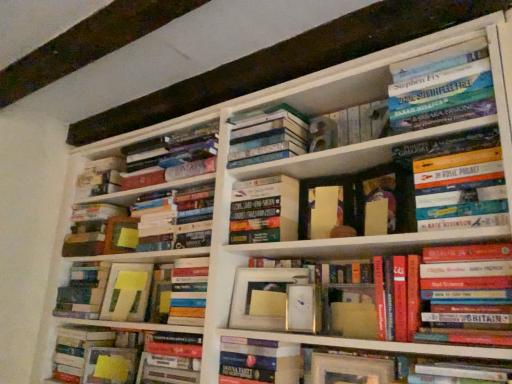
Question: Does hardcover book at center, the 5th book when ordered from left to right, have a larger size compared to hardcover book at upper right, acting as the eleventh book starting from the left?

Choices:
 (A) yes
 (B) no

Answer: (A)

Question: From a real-world perspective, is hardcover book at center, the 5th book when ordered from left to right, under hardcover book at upper right, acting as the eleventh book starting from the left?

Choices:
 (A) yes
 (B) no

Answer: (A)

Question: Is hardcover book at center, the eighth book from the right, looking in the opposite direction of hardcover book at upper right, the second book in the right-to-left sequence?

Choices:
 (A) no
 (B) yes

Answer: (A)

Question: Is hardcover book at center, the 5th book when ordered from left to right, positioned in front of hardcover book at upper right, the second book in the right-to-left sequence?

Choices:
 (A) yes
 (B) no

Answer: (B)

Question: Is hardcover book at center, the 5th book when ordered from left to right, smaller than hardcover book at upper right, the second book in the right-to-left sequence?

Choices:
 (A) no
 (B) yes

Answer: (A)

Question: Is hardcover book at center, the 5th book when ordered from left to right, aimed at hardcover book at upper right, acting as the eleventh book starting from the left?

Choices:
 (A) no
 (B) yes

Answer: (A)

Question: Is hardcover book at upper right, the second book in the right-to-left sequence, at the back of matte white frame at center, the third paperback book positioned from the back?

Choices:
 (A) no
 (B) yes

Answer: (A)

Question: From the image's perspective, is matte white frame at center, the third paperback book positioned from the back, above hardcover book at upper right, acting as the eleventh book starting from the left?

Choices:
 (A) no
 (B) yes

Answer: (A)

Question: Does matte white frame at center, which appears as the 3th paperback book when viewed from the left, touch hardcover book at upper right, acting as the eleventh book starting from the left?

Choices:
 (A) yes
 (B) no

Answer: (B)

Question: From a real-world perspective, is matte white frame at center, the third paperback book positioned from the back, positioned over hardcover book at upper right, acting as the eleventh book starting from the left, based on gravity?

Choices:
 (A) no
 (B) yes

Answer: (A)

Question: Is matte white frame at center, which appears as the 3th paperback book when viewed from the left, taller than hardcover book at upper right, acting as the eleventh book starting from the left?

Choices:
 (A) yes
 (B) no

Answer: (A)

Question: Can you confirm if matte white frame at center, the 1th paperback book from the front, is positioned to the right of hardcover book at upper right, acting as the eleventh book starting from the left?

Choices:
 (A) yes
 (B) no

Answer: (B)

Question: Is matte yellow paper at center, the 1th paperback book in the back-to-front sequence, positioned before matte yellow sticky notes at center, the 1th book when ordered from left to right?

Choices:
 (A) yes
 (B) no

Answer: (B)